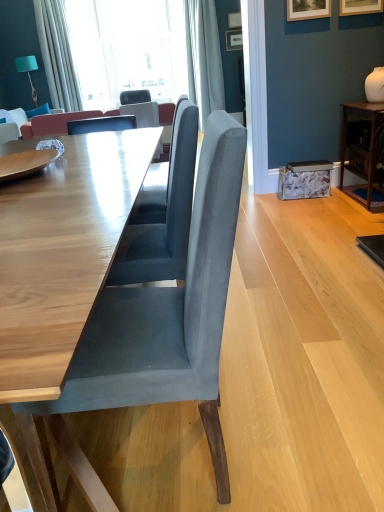
Question: Is wooden picture frame at upper center, which is the 1th picture frame in top-to-bottom order, to the left or to the right of suede gray chair at center, arranged as the 1th chair when viewed from the right, in the image?

Choices:
 (A) left
 (B) right

Answer: (B)

Question: In terms of width, does wooden picture frame at upper center, which is counted as the third picture frame, starting from the front, look wider or thinner when compared to suede gray chair at center, the first chair from the bottom?

Choices:
 (A) thin
 (B) wide

Answer: (A)

Question: Considering the real-world distances, which object is closest to the dark wood table at right, marked as the 1th table in a right-to-left arrangement?

Choices:
 (A) slate gray fabric chair at center, the second chair viewed from the right
 (B) wooden picture frame at upper center, which is counted as the third picture frame, starting from the front
 (C) satin fabric curtain at upper center, which ranks as the 2th curtain in left-to-right order
 (D) wooden table at center, which is the 2th table from right to left
 (E) teal fabric lampshade at upper left

Answer: (C)

Question: Estimate the real-world distances between objects in this image. Which object is closer to the velvet blue pillow at upper left?

Choices:
 (A) wooden picture frame at upper center, which ranks as the 4th picture frame in front-to-back order
 (B) wooden picture frame at upper right, which appears as the 2th picture frame when ordered from the bottom
 (C) wooden table at center, which is the 2th table from right to left
 (D) slate gray fabric chair at center, placed as the second chair when sorted from back to front
 (E) satin fabric curtain at upper center, which is the 1th curtain in right-to-left order

Answer: (D)